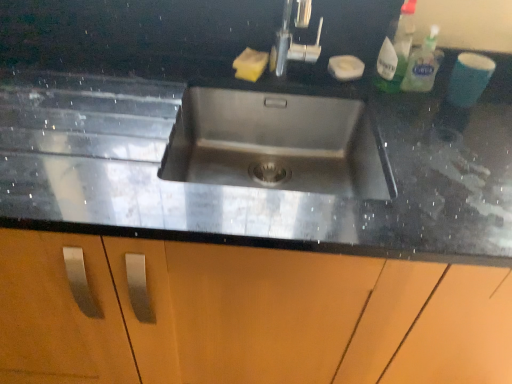
At what (x,y) coordinates should I click in order to perform the action: click on free point above black granite sink at center (from a real-world perspective). Please return your answer as a coordinate pair (x, y). The image size is (512, 384). Looking at the image, I should click on (243, 73).